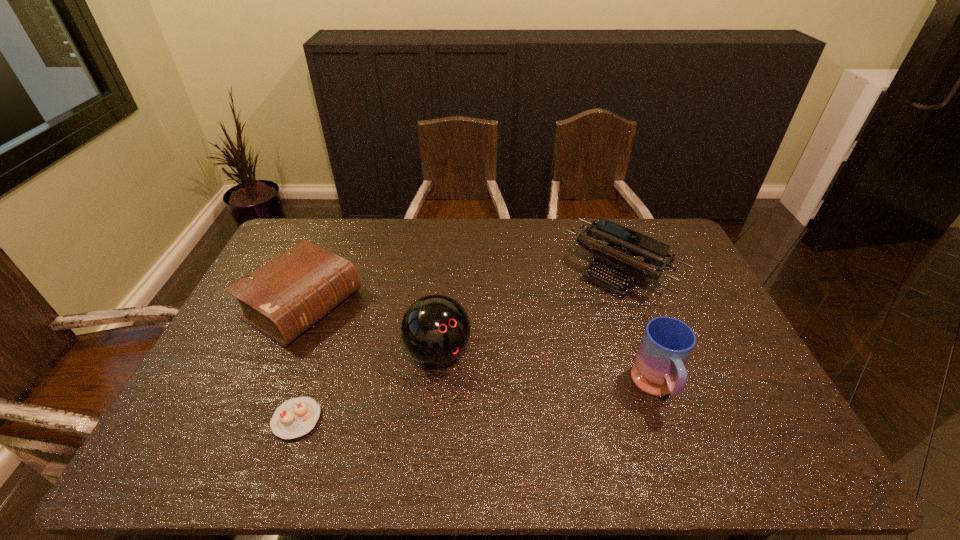
Image resolution: width=960 pixels, height=540 pixels. In order to click on vacant space located 0.190m on the typing side of the typewriter in this screenshot , I will do `click(556, 328)`.

Find the location of a particular element. The height and width of the screenshot is (540, 960). free space located on the typing side of the typewriter is located at coordinates (518, 364).

At what (x,y) coordinates should I click in order to perform the action: click on free space located on the surface of the bowling ball near the finger holes. Please return your answer as a coordinate pair (x, y). This screenshot has height=540, width=960. Looking at the image, I should click on (502, 424).

Locate an element on the screen. vacant space situated 0.070m on the surface of the bowling ball near the finger holes is located at coordinates tap(472, 391).

Identify the location of vacant space located on the surface of the bowling ball near the finger holes. The width and height of the screenshot is (960, 540). (494, 416).

Identify the location of object that is at the far edge. Image resolution: width=960 pixels, height=540 pixels. (614, 252).

The image size is (960, 540). What are the coordinates of `cupcake positioned at the near edge` in the screenshot? It's located at (296, 417).

Identify the location of mug at the near edge. The width and height of the screenshot is (960, 540). (667, 343).

At what (x,y) coordinates should I click in order to perform the action: click on object at the left edge. Please return your answer as a coordinate pair (x, y). Looking at the image, I should click on (282, 299).

The height and width of the screenshot is (540, 960). In order to click on object present at the right edge in this screenshot , I will do `click(614, 252)`.